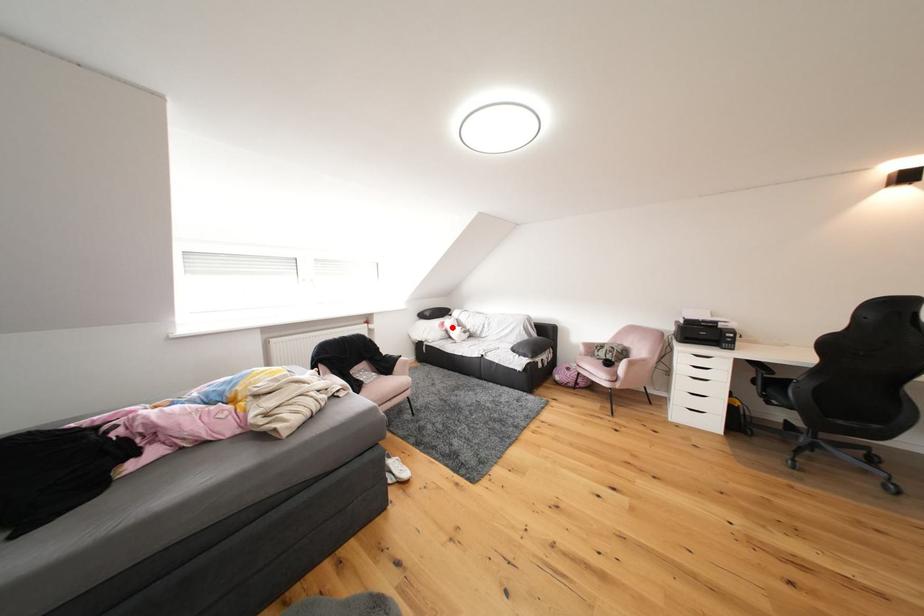
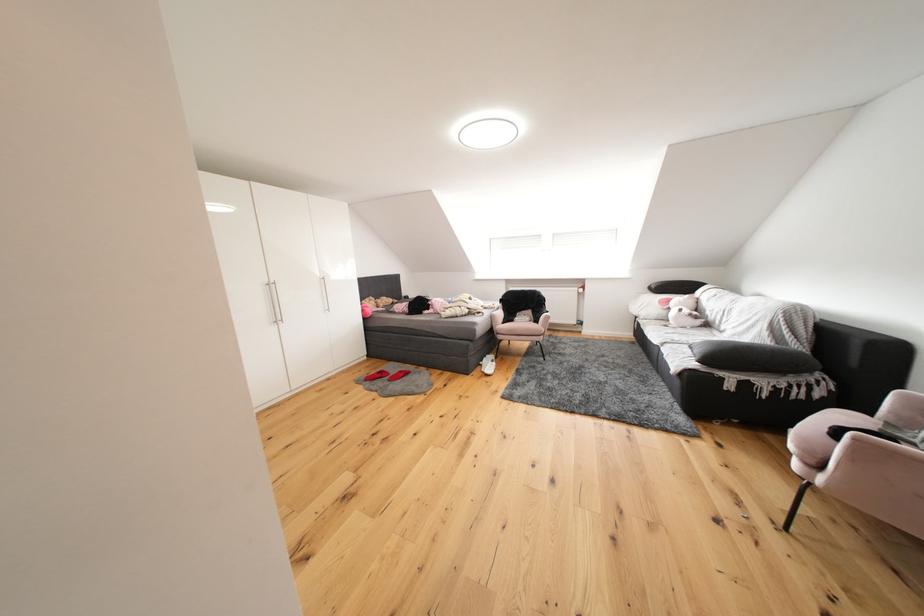
Question: I am providing you with two images of the same scene from different viewpoints. A red point is shown in image1. For the corresponding object point in image2, is it positioned nearer or farther from the camera?

Choices:
 (A) Nearer
 (B) Farther

Answer: (A)